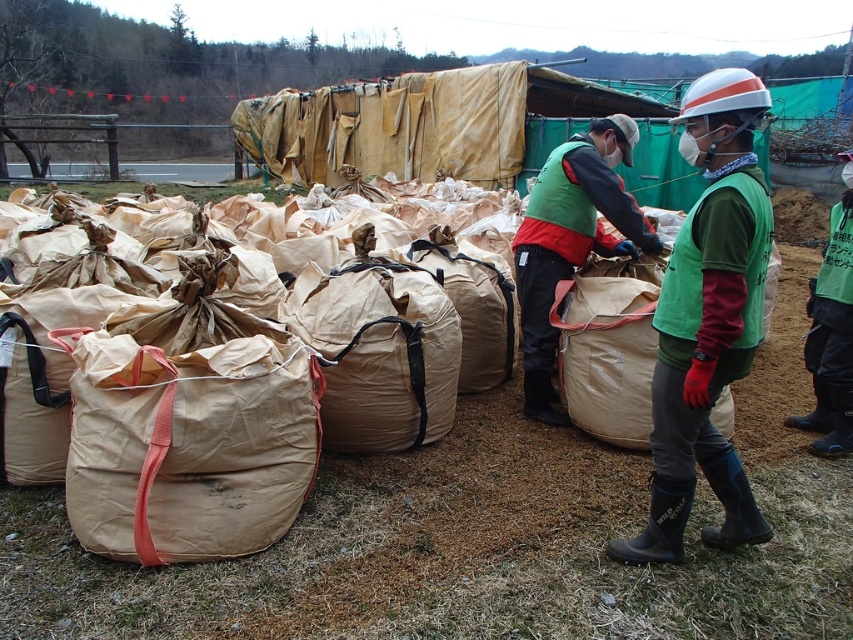
Is green fabric vest at center to the right of beige paper sack at center from the viewer's perspective?

Indeed, green fabric vest at center is positioned on the right side of beige paper sack at center.

Is green fabric vest at center smaller than beige paper sack at center?

Actually, green fabric vest at center might be larger than beige paper sack at center.

Between point (712, 324) and point (351, 323), which one is positioned behind?

Positioned behind is point (351, 323).

I want to click on green fabric vest at center, so click(x=708, y=320).

In the scene shown: Which of these two, green fabric vest at center or brown paper sack at center, stands taller?

green fabric vest at center

The width and height of the screenshot is (853, 640). Identify the location of green fabric vest at center. (708, 320).

Describe the element at coordinates (379, 355) in the screenshot. The width and height of the screenshot is (853, 640). I see `beige paper sack at center` at that location.

Is beige paper sack at center to the left of brown paper sack at center from the viewer's perspective?

Indeed, beige paper sack at center is positioned on the left side of brown paper sack at center.

Who is more distant from viewer, [436,339] or [727,420]?

Point [727,420]

Identify the location of beige paper sack at center. (379, 355).